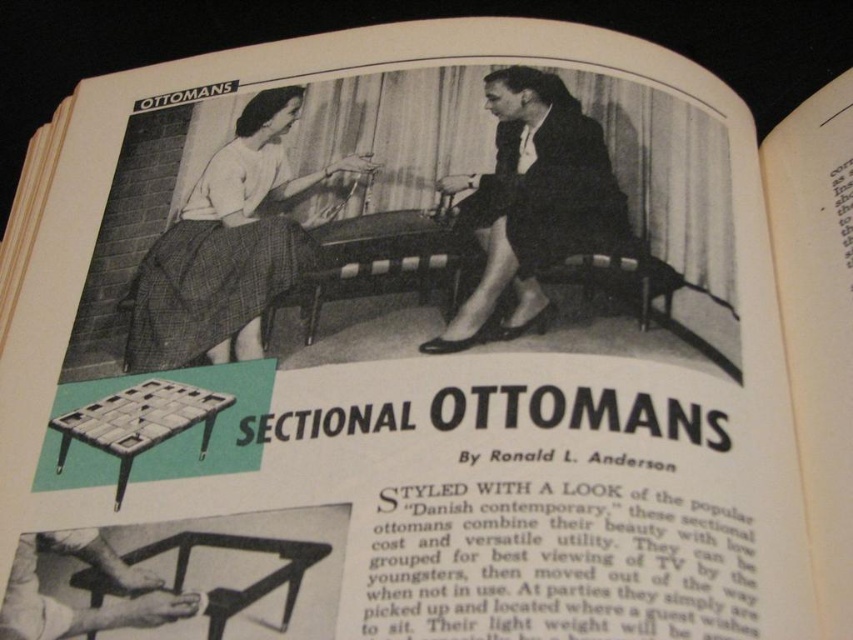
You are designing a layout for a magazine page and need to ensure that the white woven skirt at upper left and the dark suit at center are spaced appropriately for readability. Given that the minimum required spacing between elements for readability is 7 inches, will the current 7.48 inches suffice?

The white woven skirt at upper left and the dark suit at center are 7.48 inches apart, which exceeds the minimum required spacing of 7 inches. Therefore, the current spacing of 7.48 inches is sufficient for readability.

You are an interior designer observing the vintage magazine page. You notice the white woven skirt at upper left and the dark suit at center. Which item appears closer to you in the image?

The white woven skirt at upper left is closer to you because it is positioned further to the viewer than the dark suit at center.

You are a fashion designer analyzing the vintage magazine page. You notice the white woven skirt at upper left and the dark suit at center. Which clothing item is wider?

The white woven skirt at upper left is wider than the dark suit at center.